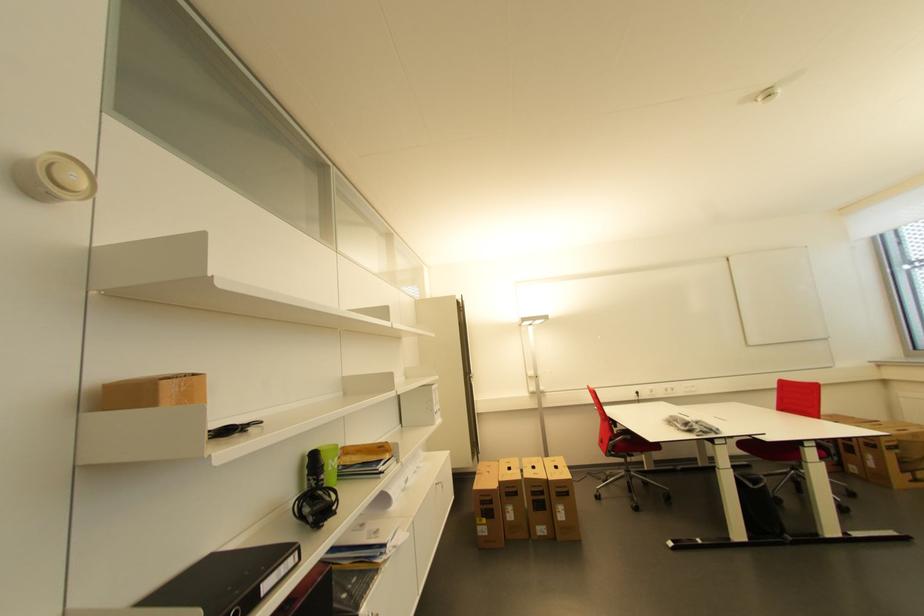
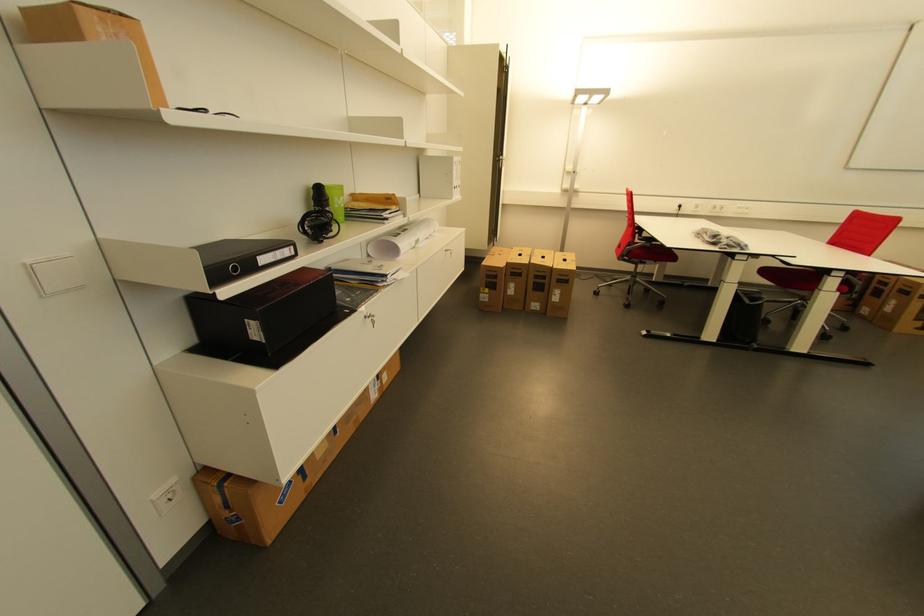
Where in the second image is the point corresponding to the point at 548,493 from the first image?

(550, 278)